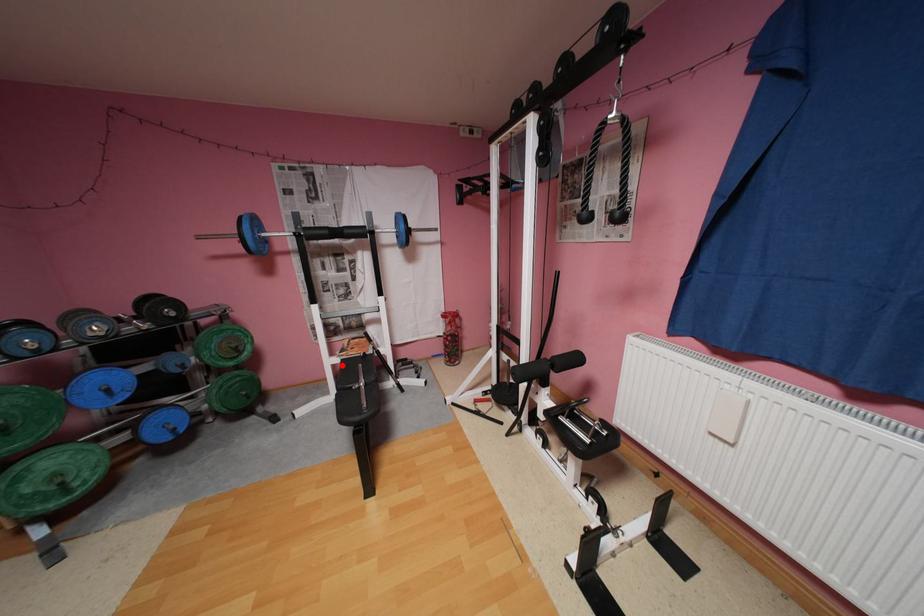
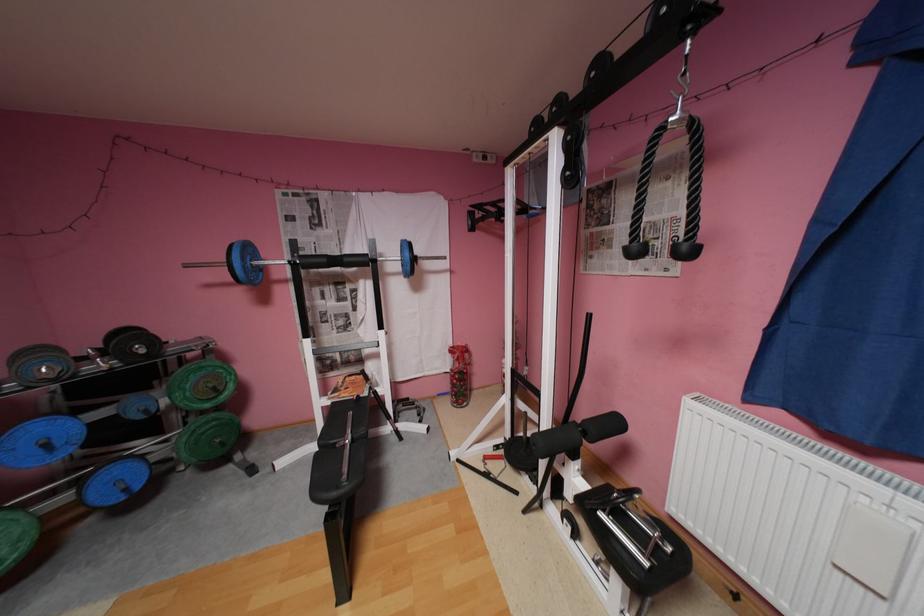
Question: I am providing you with two images of the same scene from different viewpoints. A red point is marked on the first image. Is the red point's position out of view in image 2?

Choices:
 (A) Yes
 (B) No

Answer: (B)